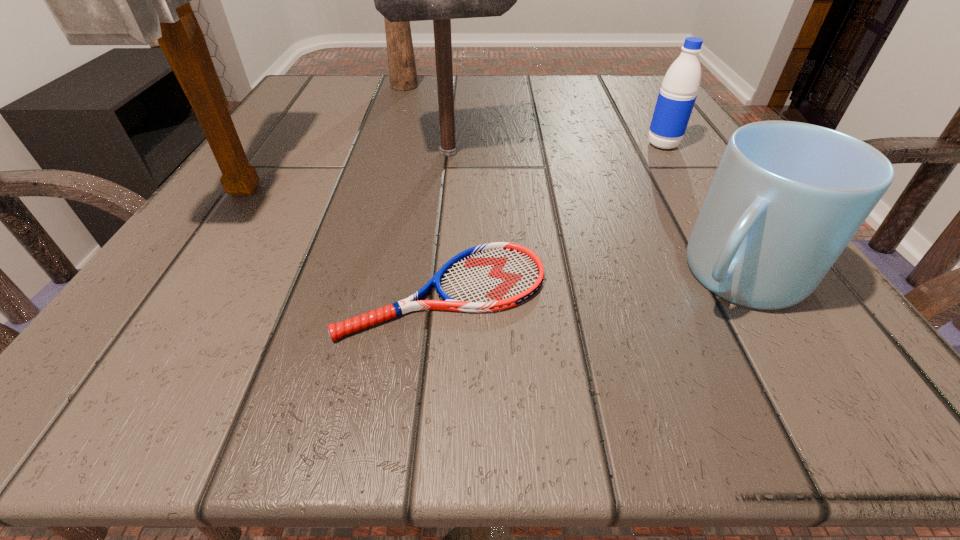
Identify the location of the farthest mallet. This screenshot has width=960, height=540. (402, 69).

Find the location of a particular element. This screenshot has width=960, height=540. the leftmost mallet is located at coordinates (96, 0).

The height and width of the screenshot is (540, 960). Identify the location of water bottle. (676, 99).

In order to click on mug in this screenshot , I will do tap(787, 198).

The image size is (960, 540). I want to click on tennis racket, so click(x=494, y=276).

Where is `free location located on the right of the farthest mallet`? The height and width of the screenshot is (540, 960). free location located on the right of the farthest mallet is located at coordinates click(522, 86).

At what (x,y) coordinates should I click in order to perform the action: click on blank space located 0.120m on the back of the leftmost object. Please return your answer as a coordinate pair (x, y). This screenshot has height=540, width=960. Looking at the image, I should click on (297, 117).

Where is `vacant space located 0.160m on the back of the water bottle`? This screenshot has height=540, width=960. vacant space located 0.160m on the back of the water bottle is located at coordinates (636, 100).

Where is `vacant space located 0.360m on the back of the mug`? Image resolution: width=960 pixels, height=540 pixels. vacant space located 0.360m on the back of the mug is located at coordinates (641, 117).

This screenshot has width=960, height=540. I want to click on free location located 0.280m on the back of the tennis racket, so click(456, 144).